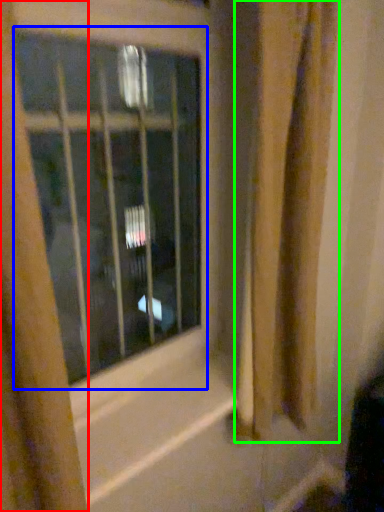
Question: Based on their relative distances, which object is nearer to curtain (highlighted by a red box)? Choose from window (highlighted by a blue box) and shower curtain (highlighted by a green box).

Choices:
 (A) window
 (B) shower curtain

Answer: (B)